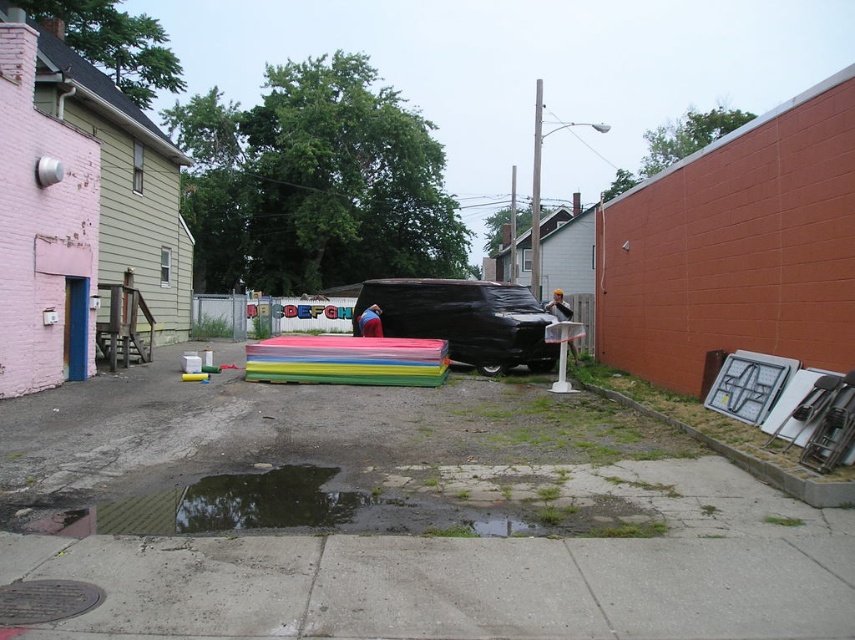
Looking at this image, between black matte van at center and brick at lower right, which one appears on the left side from the viewer's perspective?

Positioned to the left is black matte van at center.

Which is below, black matte van at center or brick at lower right?

brick at lower right is below.

At what (x,y) coordinates should I click in order to perform the action: click on black matte van at center. Please return your answer as a coordinate pair (x, y). Looking at the image, I should click on (464, 320).

Which of these two, concrete pavement at center or brick at lower right, stands taller?

With more height is concrete pavement at center.

Can you confirm if concrete pavement at center is positioned above brick at lower right?

Incorrect, concrete pavement at center is not positioned above brick at lower right.

This screenshot has width=855, height=640. What do you see at coordinates (399, 516) in the screenshot?
I see `concrete pavement at center` at bounding box center [399, 516].

Where is `concrete pavement at center`? The width and height of the screenshot is (855, 640). concrete pavement at center is located at coordinates (399, 516).

Between concrete pavement at center and black matte van at center, which one is positioned higher?

black matte van at center

Does point (821, 547) lie in front of point (511, 301)?

Yes, point (821, 547) is closer to viewer.

The height and width of the screenshot is (640, 855). In order to click on concrete pavement at center in this screenshot , I will do `click(399, 516)`.